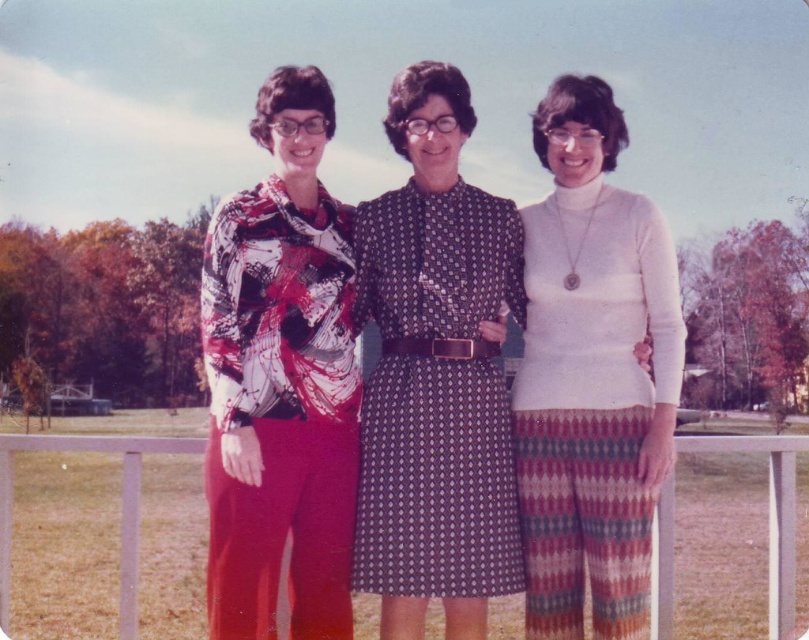
You are a fashion designer analyzing the outfits of two women in the image. The first woman wears a printed silk blouse at left, and the second wears white knitwear at center. Which of these two outfits has a shorter length?

The printed silk blouse at left has a lesser height compared to white knitwear at center, so the printed silk blouse at left has a shorter length.